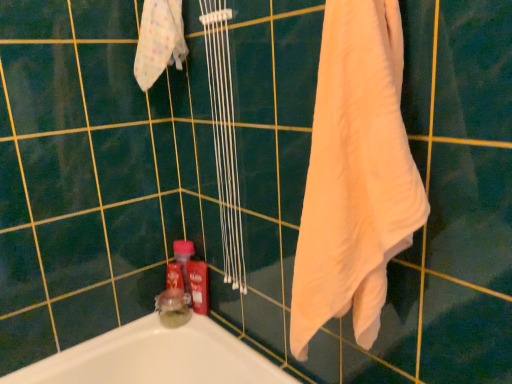
Question: Is the position of red glossy bottle at lower center less distant than that of white soft towel at right?

Choices:
 (A) no
 (B) yes

Answer: (A)

Question: Are red glossy bottle at lower center and white soft towel at right far apart?

Choices:
 (A) no
 (B) yes

Answer: (A)

Question: Can you confirm if red glossy bottle at lower center is bigger than white soft towel at right?

Choices:
 (A) no
 (B) yes

Answer: (A)

Question: Considering the relative sizes of red glossy bottle at lower center and white soft towel at right in the image provided, is red glossy bottle at lower center taller than white soft towel at right?

Choices:
 (A) yes
 (B) no

Answer: (B)

Question: Is red glossy bottle at lower center positioned beyond the bounds of white soft towel at right?

Choices:
 (A) no
 (B) yes

Answer: (B)

Question: Choose the correct answer: Is white soft towel at right inside white soft cloth at upper left or outside it?

Choices:
 (A) inside
 (B) outside

Answer: (B)

Question: Considering the positions of white soft towel at right and white soft cloth at upper left in the image, is white soft towel at right bigger or smaller than white soft cloth at upper left?

Choices:
 (A) big
 (B) small

Answer: (A)

Question: In the image, is white soft towel at right on the left side or the right side of white soft cloth at upper left?

Choices:
 (A) right
 (B) left

Answer: (A)

Question: Considering their positions, is white soft towel at right located in front of or behind white soft cloth at upper left?

Choices:
 (A) front
 (B) behind

Answer: (A)

Question: In terms of width, does white soft cloth at upper left look wider or thinner when compared to translucent glass jar at lower left?

Choices:
 (A) wide
 (B) thin

Answer: (A)

Question: Is point (161, 51) closer or farther from the camera than point (163, 316)?

Choices:
 (A) closer
 (B) farther

Answer: (A)

Question: Choose the correct answer: Is white soft cloth at upper left inside translucent glass jar at lower left or outside it?

Choices:
 (A) outside
 (B) inside

Answer: (A)

Question: Would you say white soft cloth at upper left is to the left or to the right of translucent glass jar at lower left in the picture?

Choices:
 (A) left
 (B) right

Answer: (B)

Question: Is translucent glass jar at lower left spatially inside white soft cloth at upper left, or outside of it?

Choices:
 (A) outside
 (B) inside

Answer: (A)

Question: From a real-world perspective, relative to white soft cloth at upper left, is translucent glass jar at lower left vertically above or below?

Choices:
 (A) below
 (B) above

Answer: (A)